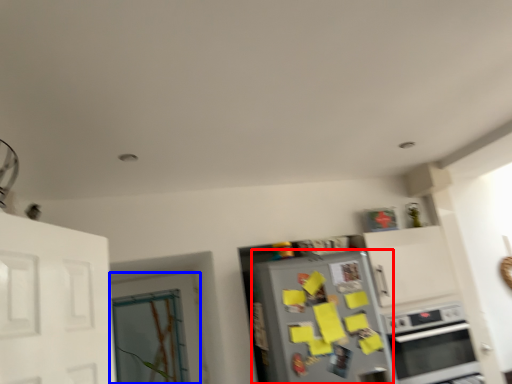
Question: Which point is closer to the camera, refrigerator (highlighted by a red box) or door (highlighted by a blue box)?

Choices:
 (A) refrigerator
 (B) door

Answer: (A)